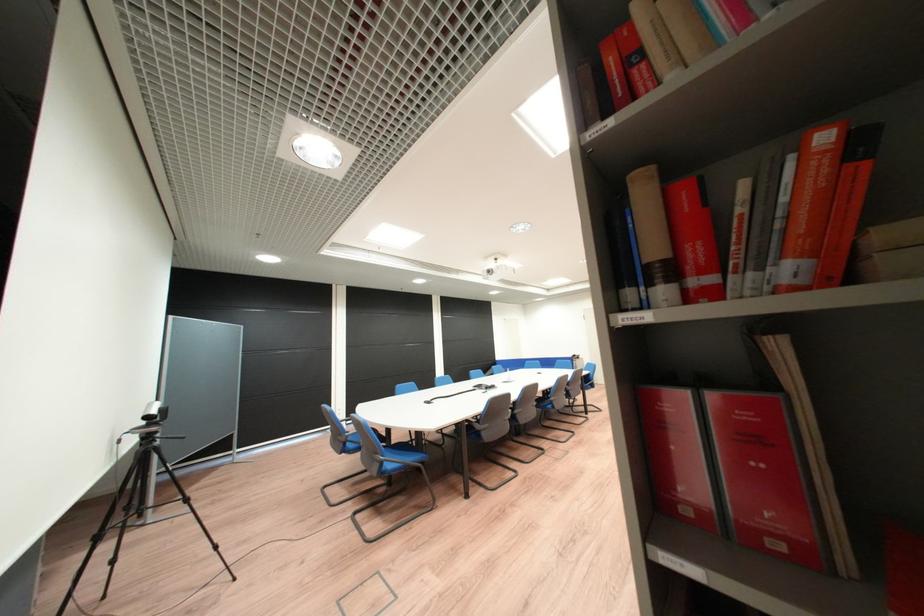
Locate an element on the screen. The image size is (924, 616). red binder is located at coordinates (676, 455).